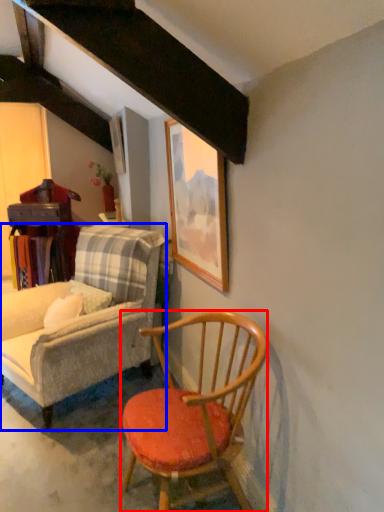
Question: Which object is closer to the camera taking this photo, chair (highlighted by a red box) or chair (highlighted by a blue box)?

Choices:
 (A) chair
 (B) chair

Answer: (A)